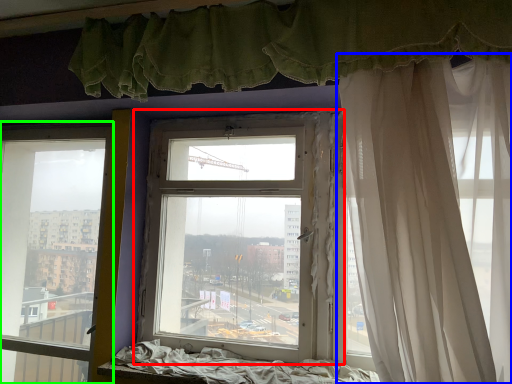
Question: Which object is positioned closest to window (highlighted by a red box)? Select from curtain (highlighted by a blue box) and window (highlighted by a green box).

Choices:
 (A) curtain
 (B) window

Answer: (A)